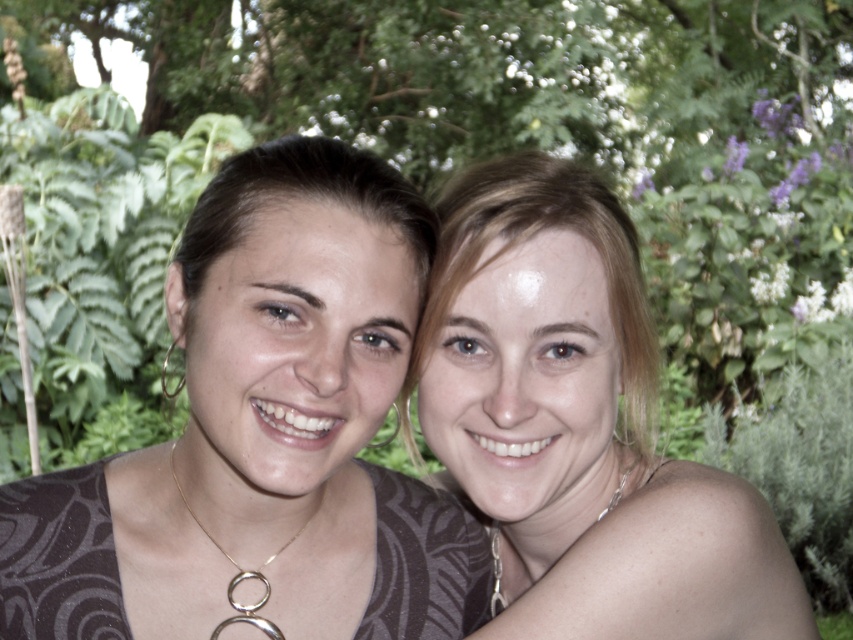
Question: Among these objects, which one is nearest to the camera?

Choices:
 (A) silver metallic chain at lower right
 (B) gold metallic necklace at center

Answer: (B)

Question: Can you confirm if smooth blonde hair at center is smaller than silver metallic chain at lower right?

Choices:
 (A) yes
 (B) no

Answer: (B)

Question: Is smooth blonde hair at center to the right of gold metallic necklace at center from the viewer's perspective?

Choices:
 (A) yes
 (B) no

Answer: (A)

Question: Which point appears farthest from the camera in this image?

Choices:
 (A) (172, 476)
 (B) (492, 611)
 (C) (654, 340)

Answer: (B)

Question: Observing the image, what is the correct spatial positioning of matte black shirt at center in reference to silver metallic chain at lower right?

Choices:
 (A) right
 (B) left

Answer: (B)

Question: Which point is farther to the camera?

Choices:
 (A) (260, 618)
 (B) (312, 634)

Answer: (B)